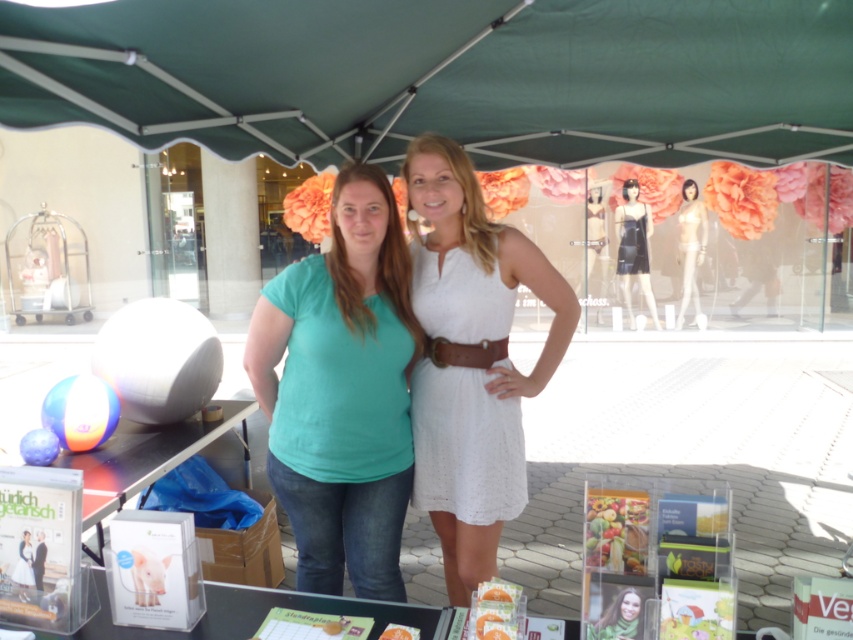
Question: Which of these objects is positioned farthest from the brown leather belt at center?

Choices:
 (A) metallic silver table at lower left
 (B) white lace dress at center

Answer: (A)

Question: Where is metallic silver table at lower left located in relation to smooth beige dress at right in the image?

Choices:
 (A) below
 (B) above

Answer: (A)

Question: Among these objects, which one is farthest from the camera?

Choices:
 (A) clear plastic table at center
 (B) smooth beige dress at right
 (C) black satin dress at upper center

Answer: (B)

Question: Is teal matte t-shirt at center below metallic silver table at lower left?

Choices:
 (A) no
 (B) yes

Answer: (A)

Question: Which of the following is the closest to the observer?

Choices:
 (A) brown leather belt at center
 (B) green fabric canopy at upper center

Answer: (B)

Question: Is green fabric canopy at upper center below brown leather belt at center?

Choices:
 (A) no
 (B) yes

Answer: (A)